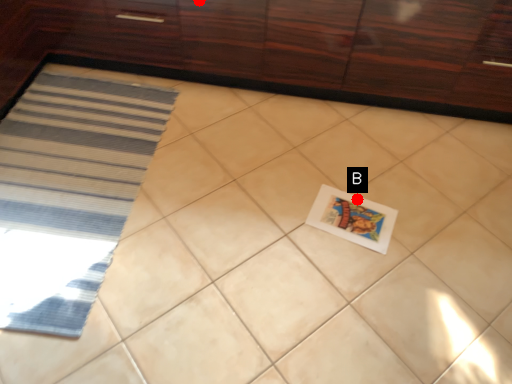
Question: Two points are circled on the image, labeled by A and B beside each circle. Which point is farther to the camera?

Choices:
 (A) A is further
 (B) B is further

Answer: (A)